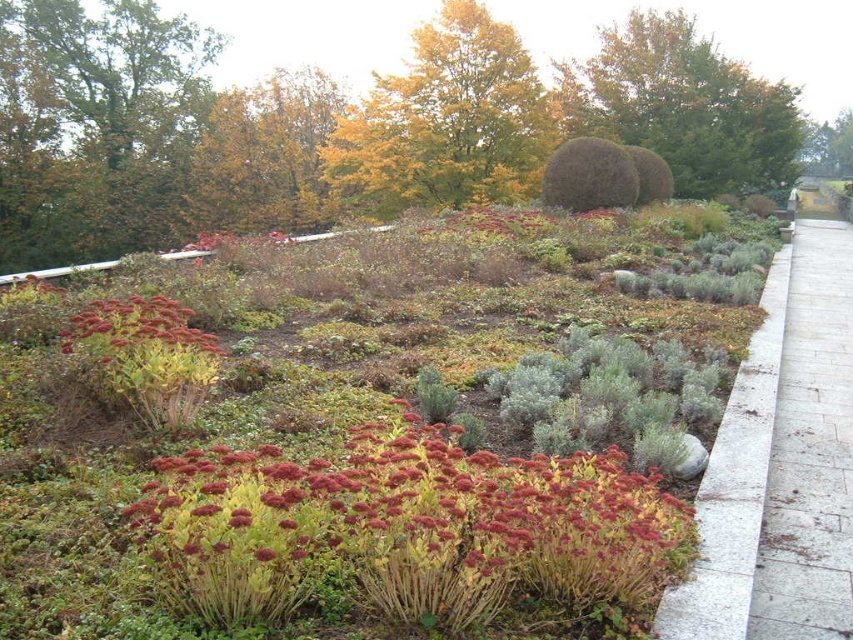
Measure the distance between point (56, 244) and camera.

Point (56, 244) and camera are 56.10 feet apart.

Can you confirm if green leafy tree at upper left is taller than green leafy tree at upper center?

Yes, green leafy tree at upper left is taller than green leafy tree at upper center.

Describe the element at coordinates (96, 125) in the screenshot. The width and height of the screenshot is (853, 640). I see `green leafy tree at upper left` at that location.

You are a GUI agent. You are given a task and a screenshot of the screen. Output one action in this format:
    pyautogui.click(x=<x>, y=<y>)
    Task: Click on the green leafy tree at upper left
    This screenshot has height=640, width=853.
    Given the screenshot: What is the action you would take?
    pyautogui.click(x=96, y=125)

Which is above, reddish-brown textured plant at center or gray stone path at right?

gray stone path at right is higher up.

Between point (225, 596) and point (842, 588), which one is positioned behind?

The point (842, 588) is more distant.

What are the coordinates of `reddish-brown textured plant at center` in the screenshot? It's located at (405, 529).

Who is positioned more to the right, reddish-brown textured plant at center or yellow-green foliage at upper center?

From the viewer's perspective, reddish-brown textured plant at center appears more on the right side.

Between point (430, 509) and point (410, 193), which one is positioned in front?

Point (430, 509) is in front.

Between point (263, 461) and point (434, 68), which one is positioned behind?

The point (434, 68) is behind.

Where is `reddish-brown textured plant at center`? The image size is (853, 640). reddish-brown textured plant at center is located at coordinates (405, 529).